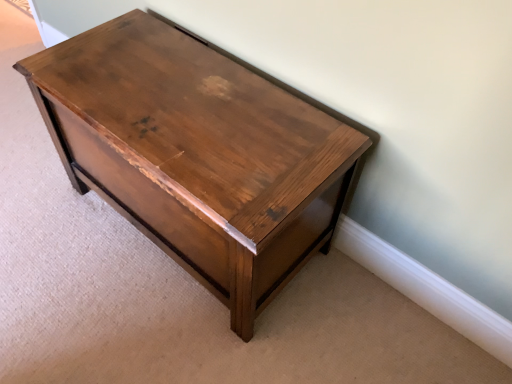
This screenshot has height=384, width=512. In order to click on empty space that is ontop of shiny brown wood chest at center (from a real-world perspective) in this screenshot , I will do `click(188, 100)`.